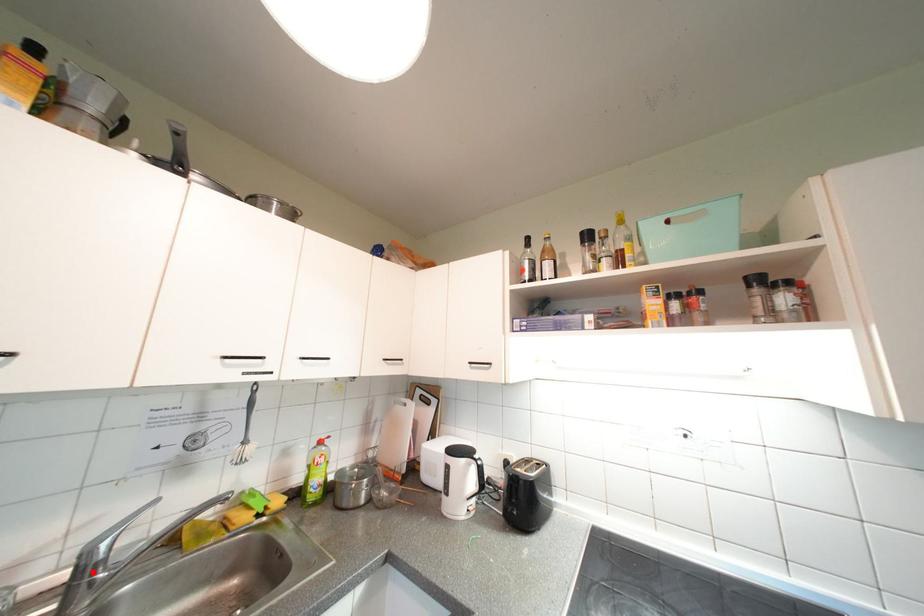
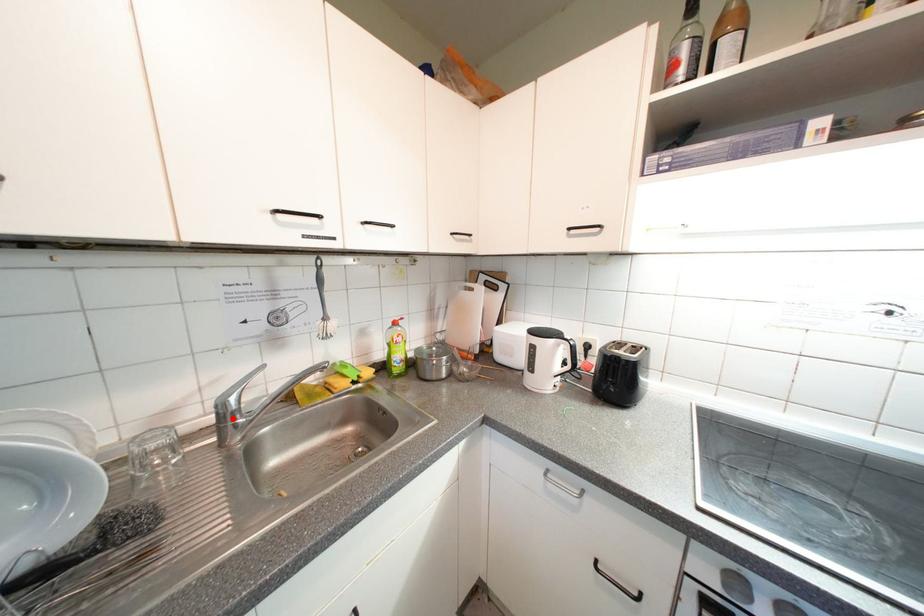
I am providing you with two images of the same scene from different viewpoints. A red point is marked on the first image and another point is marked on the second image. Is the red point in image1 aligned with the point shown in image2?

Yes